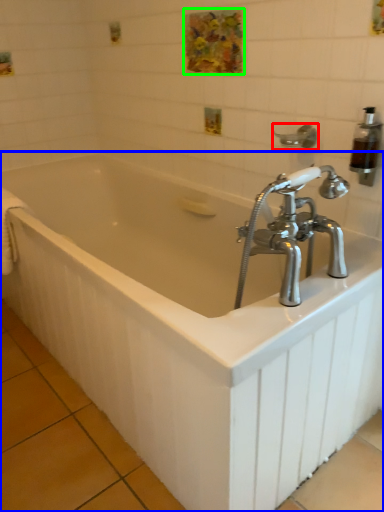
Question: Which object is positioned closest to shower (highlighted by a red box)? Select from bathtub (highlighted by a blue box) and art (highlighted by a green box).

Choices:
 (A) bathtub
 (B) art

Answer: (B)